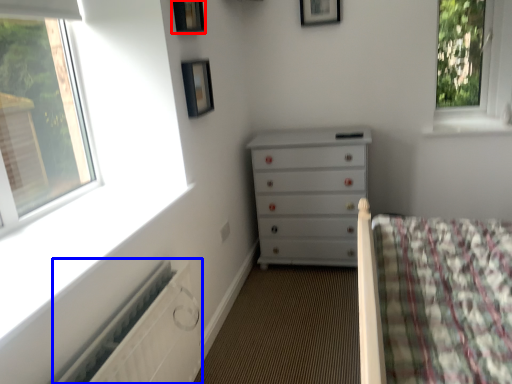
Question: Which point is closer to the camera, picture frame (highlighted by a red box) or radiator (highlighted by a blue box)?

Choices:
 (A) picture frame
 (B) radiator

Answer: (B)